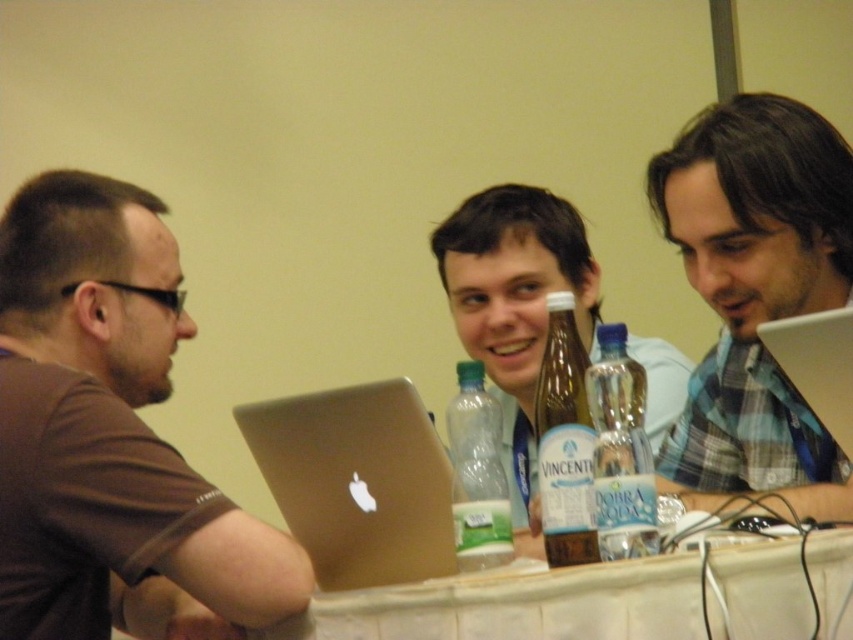
You are a photographer standing at the back of the room. You want to take a photo of the clear plastic bottle at right without including any people in the frame. Is it possible to do so given your current position?

The clear plastic bottle at right is 37.81 inches away from the camera. Since you are standing at the back of the room, it is possible to adjust your angle or zoom to capture the bottle without including people in the frame, provided there are no obstructions between you and the bottle.

You are standing in the room and want to take a photo of the point at coordinates (758, 392). The camera you are using has a minimum focus distance of 4 feet. Will the camera be able to focus on the point?

The distance of point (758, 392) from the camera is 4.50 feet, which is greater than the camera minimum focus distance of 4 feet. Therefore, the camera should be able to focus on the point.

Based on the scene description, where is the satin gold laptop at center located in terms of coordinates?

The satin gold laptop at center is located at coordinates point (357,481).